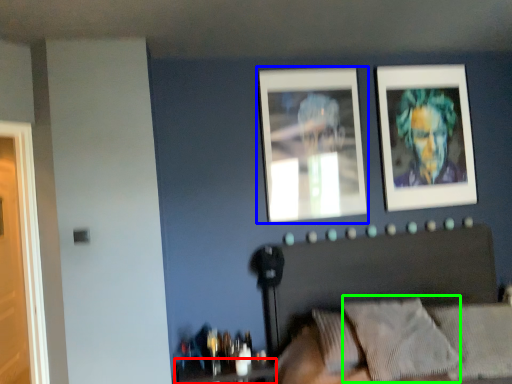
Question: Estimate the real-world distances between objects in this image. Which object is closer to table (highlighted by a red box), picture frame (highlighted by a blue box) or pillow (highlighted by a green box)?

Choices:
 (A) picture frame
 (B) pillow

Answer: (B)